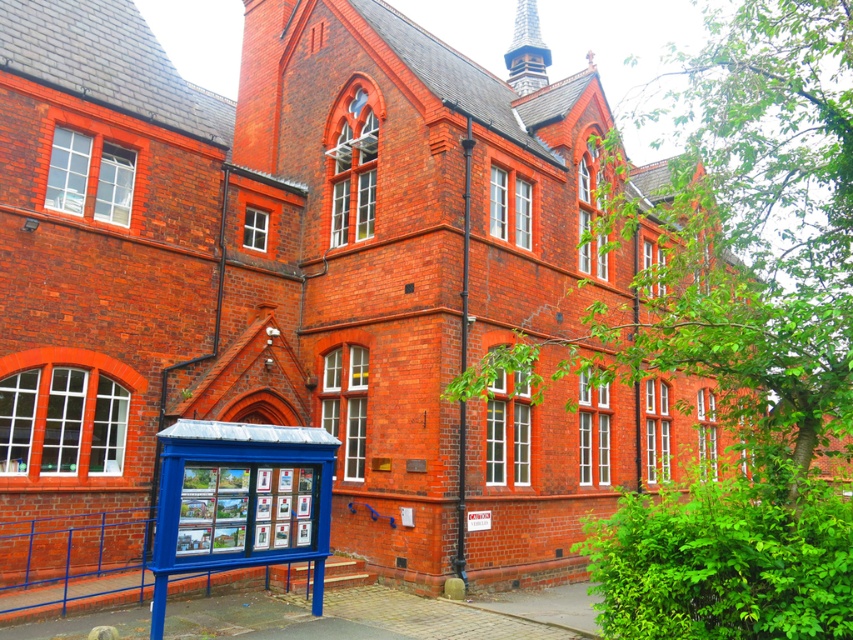
Question: Does blue metallic bus stop at lower left appear over wooden spire at upper center?

Choices:
 (A) yes
 (B) no

Answer: (B)

Question: Can you confirm if blue metallic bus stop at lower left is positioned above wooden spire at upper center?

Choices:
 (A) no
 (B) yes

Answer: (A)

Question: Which of the following is the closest to the observer?

Choices:
 (A) blue metallic bus stop at lower left
 (B) wooden spire at upper center

Answer: (A)

Question: Is blue metallic bus stop at lower left bigger than wooden spire at upper center?

Choices:
 (A) yes
 (B) no

Answer: (B)

Question: Which point is closer to the camera?

Choices:
 (A) wooden spire at upper center
 (B) blue metallic bus stop at lower left

Answer: (B)